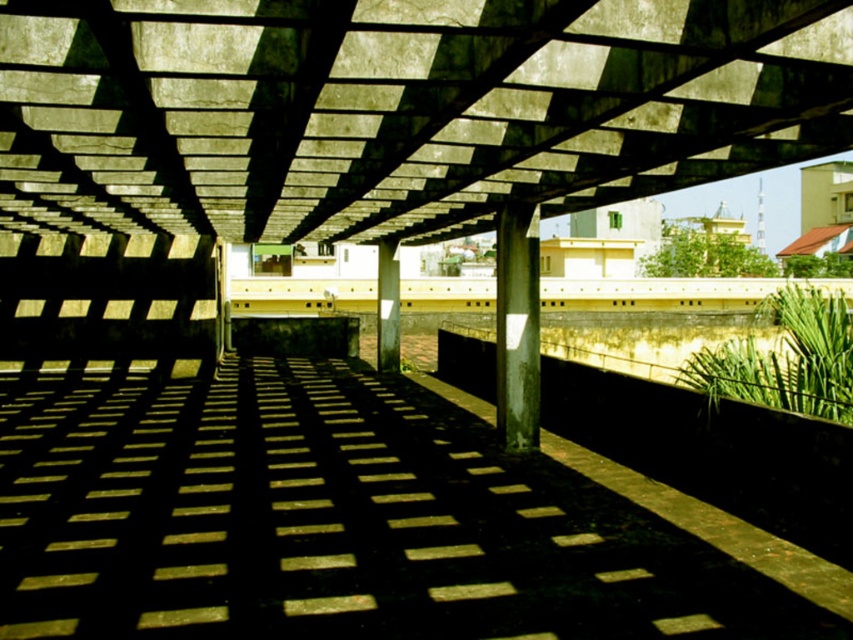
Question: Does metallic gray column at center have a lesser width compared to smooth concrete pillar at center?

Choices:
 (A) yes
 (B) no

Answer: (B)

Question: Which object is positioned closest to the smooth concrete path at center?

Choices:
 (A) concrete at center
 (B) metallic gray column at center

Answer: (A)

Question: Which object is closer to the camera taking this photo?

Choices:
 (A) concrete at center
 (B) smooth concrete path at center
 (C) smooth concrete pillar at center
 (D) metallic gray column at center

Answer: (A)

Question: Which of the following is the farthest from the observer?

Choices:
 (A) smooth concrete path at center
 (B) smooth concrete pillar at center

Answer: (B)

Question: Can you confirm if smooth concrete path at center is positioned to the left of smooth concrete pillar at center?

Choices:
 (A) yes
 (B) no

Answer: (A)

Question: Can you confirm if concrete at center is bigger than metallic gray column at center?

Choices:
 (A) yes
 (B) no

Answer: (A)